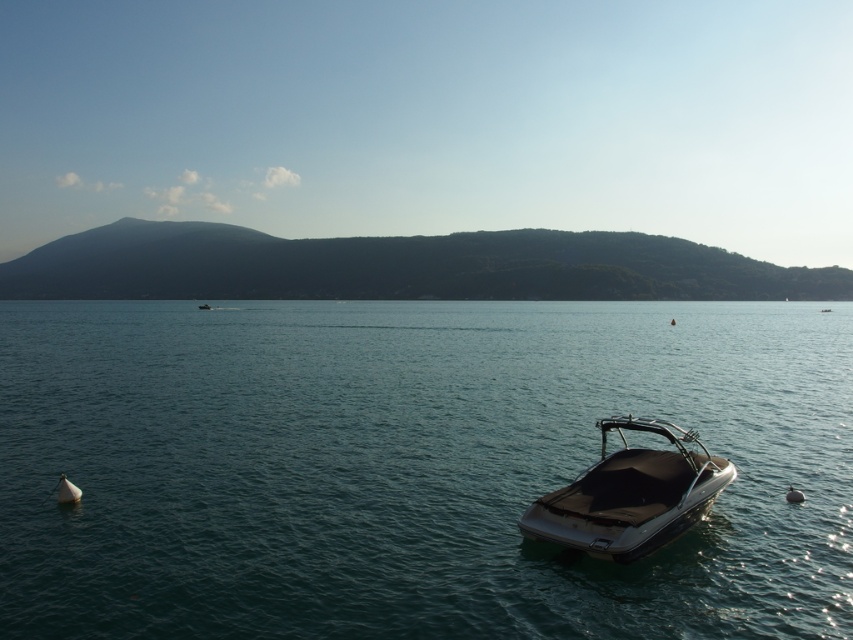
Does clear blue water at center have a smaller size compared to shiny black boat at lower right?

No, clear blue water at center is not smaller than shiny black boat at lower right.

You are a GUI agent. You are given a task and a screenshot of the screen. Output one action in this format:
    pyautogui.click(x=<x>, y=<y>)
    Task: Click on the clear blue water at center
    
    Given the screenshot: What is the action you would take?
    pyautogui.click(x=410, y=467)

Where is `clear blue water at center`? clear blue water at center is located at coordinates (410, 467).